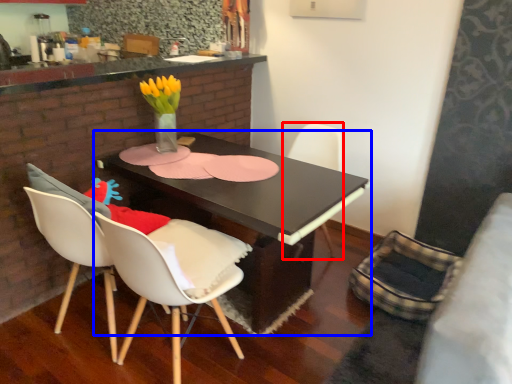
Question: Which object appears closest to the camera in this image, chair (highlighted by a red box) or table (highlighted by a blue box)?

Choices:
 (A) chair
 (B) table

Answer: (B)